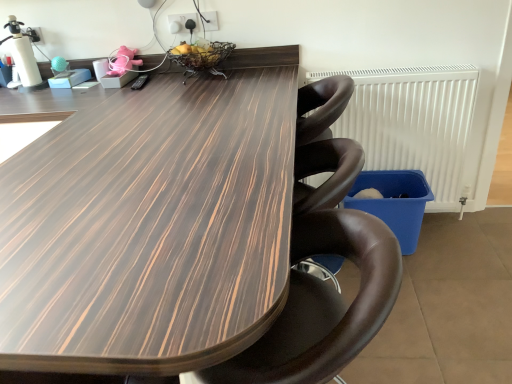
Question: In terms of width, does wooden table at center look wider or thinner when compared to white plastic radiator at right?

Choices:
 (A) wide
 (B) thin

Answer: (A)

Question: Considering the positions of wooden table at center and white plastic radiator at right in the image, is wooden table at center taller or shorter than white plastic radiator at right?

Choices:
 (A) short
 (B) tall

Answer: (B)

Question: Estimate the real-world distances between objects in this image. Which object is closer to the brown leather chair at center?

Choices:
 (A) white plastic radiator at right
 (B) wooden table at center
 (C) pink fabric toy at upper center

Answer: (B)

Question: Which is nearer to the white plastic radiator at right?

Choices:
 (A) pink fabric toy at upper center
 (B) wooden table at center
 (C) brown leather chair at center

Answer: (B)